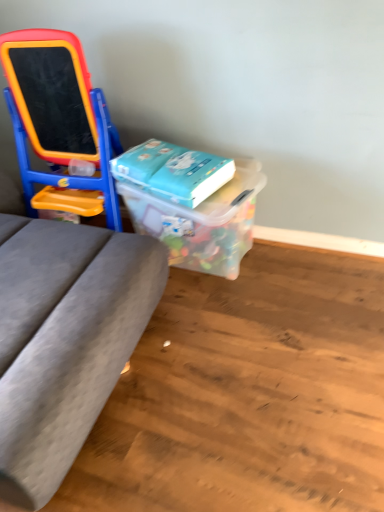
Question: Based on their positions, is matte plastic easel at left located to the left or right of translucent plastic container at center?

Choices:
 (A) right
 (B) left

Answer: (B)

Question: Is matte plastic easel at left spatially inside translucent plastic container at center, or outside of it?

Choices:
 (A) inside
 (B) outside

Answer: (B)

Question: Which is nearer to the blue matte book at center?

Choices:
 (A) matte plastic easel at left
 (B) translucent plastic container at center

Answer: (B)

Question: Estimate the real-world distances between objects in this image. Which object is farther from the translucent plastic container at center?

Choices:
 (A) blue matte book at center
 (B) matte plastic easel at left

Answer: (B)